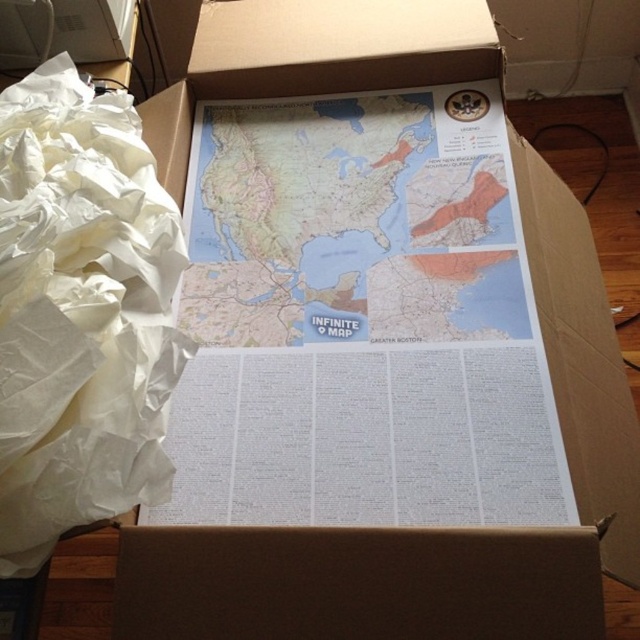
You are a delivery person who just opened a box and found the matte paper map at center and the white crumpled paper at left inside. You need to place both items on a shelf that is 10 inches wide. Can both items fit side by side on the shelf without overlapping?

The matte paper map at center is 8.97 inches away from the white crumpled paper at left, so the combined width of both items is 8.97 inches. Since the shelf is 10 inches wide, there is enough space to place both items side by side without overlapping.

You are organizing a geography class and need to display the matte paper map at center and the white crumpled paper at left. Which object should you choose if you want to use the larger one for a wall poster?

The matte paper map at center should be chosen because its width is larger than the white crumpled paper at left.

You are standing at the edge of the open cardboard box and see the point marked at coordinates (x=353, y=220). What object is located at that point?

The point at coordinates (x=353, y=220) marks the matte paper map at center.